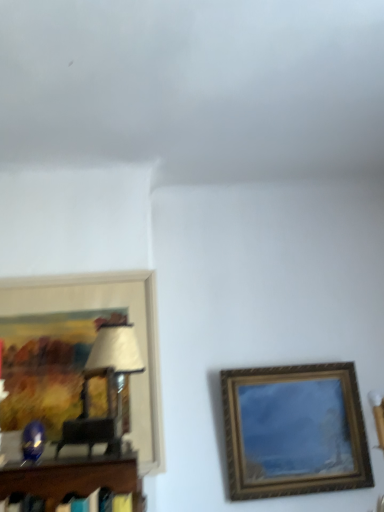
Question: In terms of width, does wooden framed artwork at left, positioned as the second picture frame in right-to-left order, look wider or thinner when compared to gold-framed painting at right, the second picture frame from the left?

Choices:
 (A) wide
 (B) thin

Answer: (B)

Question: In the image, is wooden framed artwork at left, positioned as the second picture frame in right-to-left order, on the left side or the right side of gold-framed painting at right, the second picture frame from the left?

Choices:
 (A) right
 (B) left

Answer: (B)

Question: From a real-world perspective, is wooden framed artwork at left, positioned as the second picture frame in right-to-left order, positioned above or below gold-framed painting at right, the first picture frame viewed from the right?

Choices:
 (A) below
 (B) above

Answer: (B)

Question: From the image's perspective, is gold-framed painting at right, the second picture frame from the left, located above or below wooden framed artwork at left, which is counted as the first picture frame, starting from the left?

Choices:
 (A) below
 (B) above

Answer: (A)

Question: Is gold-framed painting at right, the second picture frame from the left, bigger or smaller than wooden framed artwork at left, which is counted as the first picture frame, starting from the left?

Choices:
 (A) big
 (B) small

Answer: (A)

Question: Do you think gold-framed painting at right, the first picture frame viewed from the right, is within wooden framed artwork at left, which is counted as the first picture frame, starting from the left, or outside of it?

Choices:
 (A) outside
 (B) inside

Answer: (A)

Question: From their relative heights in the image, would you say gold-framed painting at right, the first picture frame viewed from the right, is taller or shorter than wooden framed artwork at left, positioned as the second picture frame in right-to-left order?

Choices:
 (A) short
 (B) tall

Answer: (A)